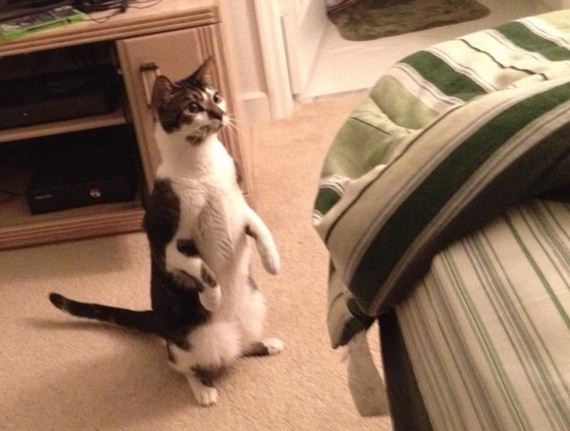
The image size is (570, 431). I want to click on blanket, so click(x=446, y=213).